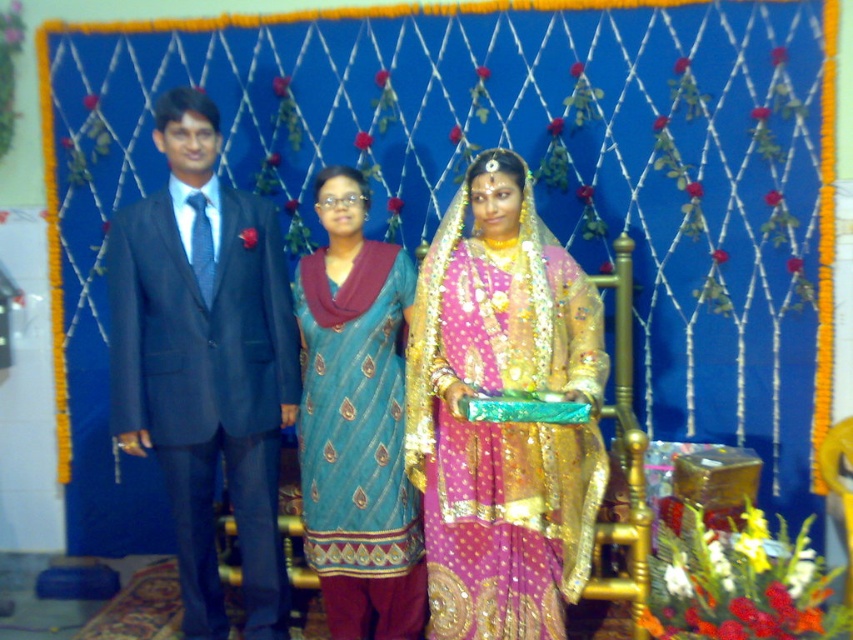
Question: Does shiny gold saree at center have a greater width compared to shiny blue suit at left?

Choices:
 (A) no
 (B) yes

Answer: (B)

Question: Can you confirm if shiny gold saree at center is wider than teal silk kurta at center?

Choices:
 (A) no
 (B) yes

Answer: (B)

Question: Can you confirm if shiny gold saree at center is thinner than pink satin saree at center?

Choices:
 (A) no
 (B) yes

Answer: (A)

Question: Among these objects, which one is nearest to the camera?

Choices:
 (A) pink satin saree at center
 (B) shiny blue suit at left
 (C) teal silk kurta at center
 (D) shiny gold saree at center

Answer: (D)

Question: Which is farther from the shiny blue suit at left?

Choices:
 (A) shiny gold saree at center
 (B) teal silk kurta at center
 (C) pink satin saree at center

Answer: (C)

Question: Which point appears farthest from the camera in this image?

Choices:
 (A) (228, 465)
 (B) (397, 484)

Answer: (A)